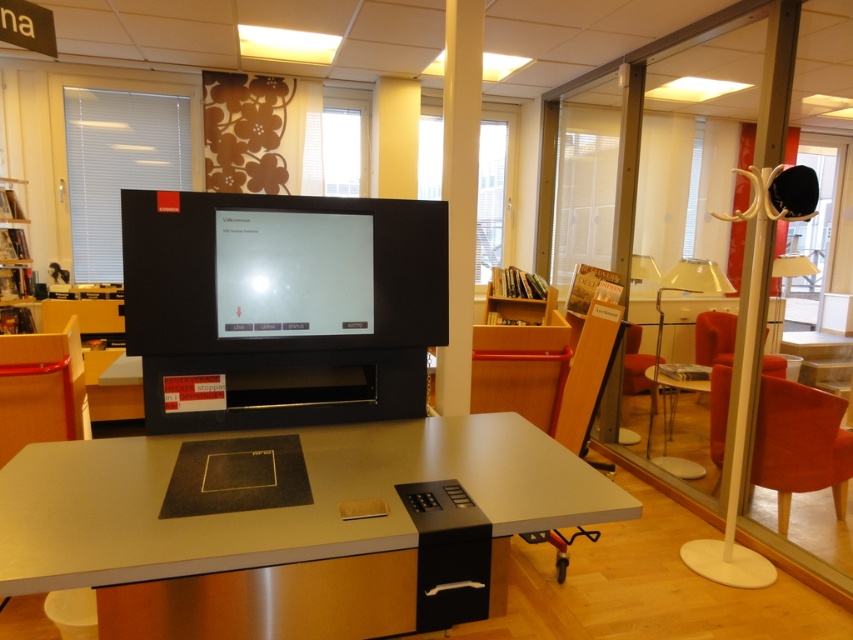
Is black matte computer monitor at center below wooden bookshelf at right?

Indeed, black matte computer monitor at center is positioned under wooden bookshelf at right.

This screenshot has height=640, width=853. I want to click on black matte computer monitor at center, so click(x=281, y=273).

Describe the element at coordinates (281, 273) in the screenshot. I see `black matte computer monitor at center` at that location.

Find the location of a particular element. black matte computer monitor at center is located at coordinates (281, 273).

Is point (155, 452) positioned after point (270, 236)?

No, it is in front of (270, 236).

Where is `matte black computer desk at center`? matte black computer desk at center is located at coordinates (277, 508).

Is transparent glass door at right shorter than velvet red armchair at right?

No, transparent glass door at right is not shorter than velvet red armchair at right.

Who is more forward, (732,371) or (689,474)?

Positioned in front is point (732,371).

Does point (640, 96) come farther from viewer compared to point (769, 358)?

That is False.

Locate an element on the screen. This screenshot has height=640, width=853. transparent glass door at right is located at coordinates (740, 253).